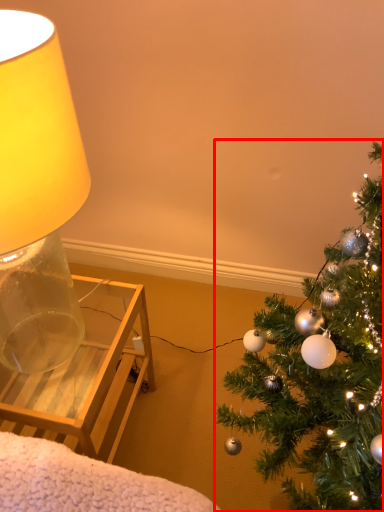
Question: From the image's perspective, considering the relative positions of christmas tree (annotated by the red box) and lamp in the image provided, where is christmas tree (annotated by the red box) located with respect to the staircase?

Choices:
 (A) above
 (B) below

Answer: (B)